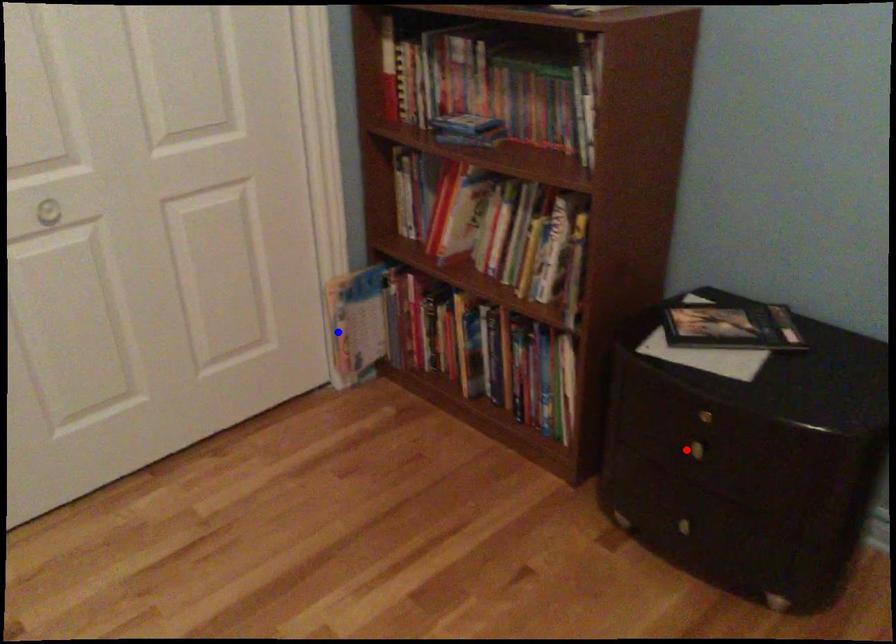
Question: Which of the two points in the image is closer to the camera?

Choices:
 (A) Blue point is closer.
 (B) Red point is closer.

Answer: (B)